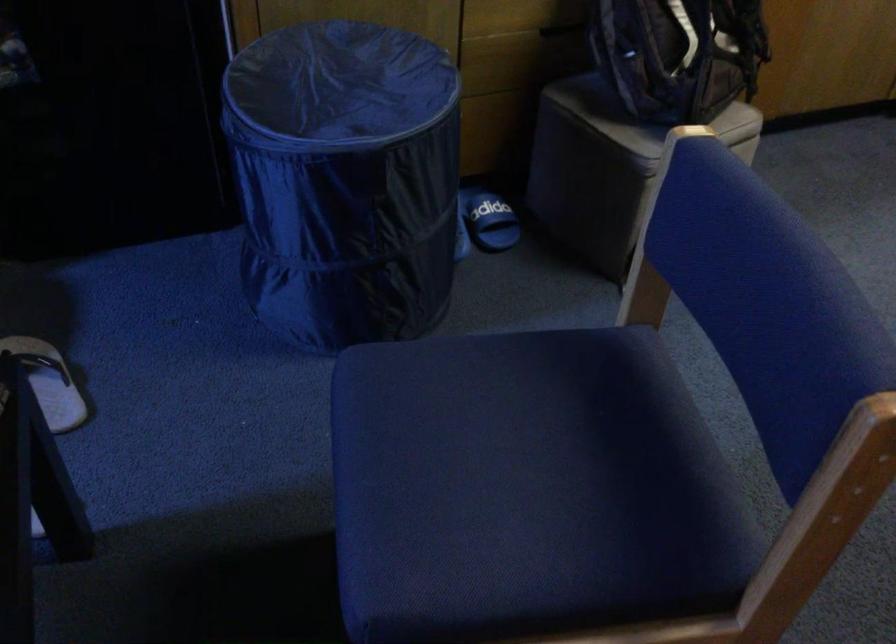
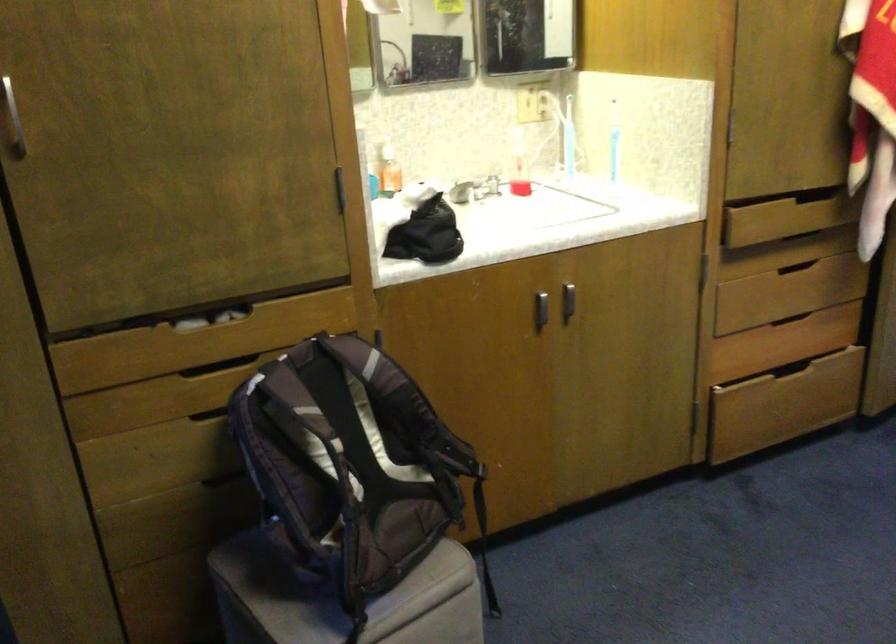
The images are taken continuously from a first-person perspective. In which direction are you moving?

The cameraman moved toward right, forward.